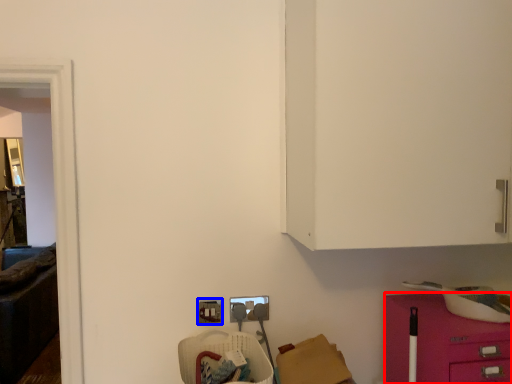
Question: Which of the following is the farthest to the observer, furniture (highlighted by a red box) or electric outlet (highlighted by a blue box)?

Choices:
 (A) furniture
 (B) electric outlet

Answer: (B)